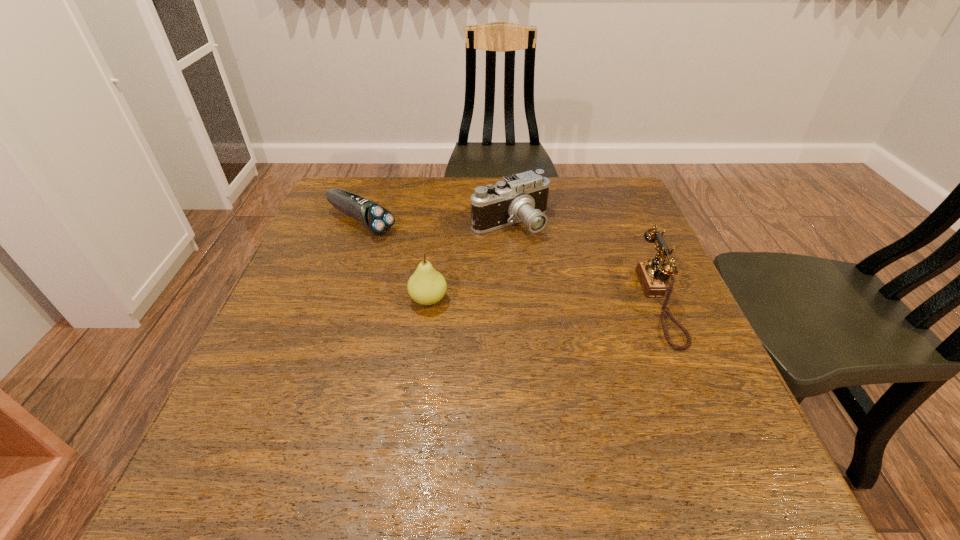
You are a GUI agent. You are given a task and a screenshot of the screen. Output one action in this format:
    pyautogui.click(x=<x>, y=<y>)
    Task: Click on the free space at the right edge
    Image resolution: width=960 pixels, height=540 pixels.
    Given the screenshot: What is the action you would take?
    pyautogui.click(x=683, y=296)

The width and height of the screenshot is (960, 540). In the image, there is a desktop. Identify the location of vacant space at the far right corner. (587, 194).

Locate an element on the screen. The height and width of the screenshot is (540, 960). vacant point located between the third object from left to right and the leftmost object is located at coordinates (436, 223).

The height and width of the screenshot is (540, 960). I want to click on free space between the telephone and the shortest object, so click(x=511, y=262).

Image resolution: width=960 pixels, height=540 pixels. Identify the location of vacant space that is in between the camera and the rightmost object. tap(586, 263).

Locate an element on the screen. vacant space in between the third object from right to left and the rightmost object is located at coordinates (544, 301).

Image resolution: width=960 pixels, height=540 pixels. In order to click on vacant area between the shortest object and the telephone in this screenshot , I will do (511, 262).

Where is `vacant area between the shortest object and the rightmost object`? This screenshot has width=960, height=540. vacant area between the shortest object and the rightmost object is located at coordinates (511, 262).

The image size is (960, 540). Find the location of `free spot between the second object from left to right and the telephone`. free spot between the second object from left to right and the telephone is located at coordinates (544, 301).

You are a GUI agent. You are given a task and a screenshot of the screen. Output one action in this format:
    pyautogui.click(x=<x>, y=<y>)
    Task: Click on the vacant area that lies between the rightmost object and the pear
    This screenshot has width=960, height=540.
    Given the screenshot: What is the action you would take?
    (544, 301)